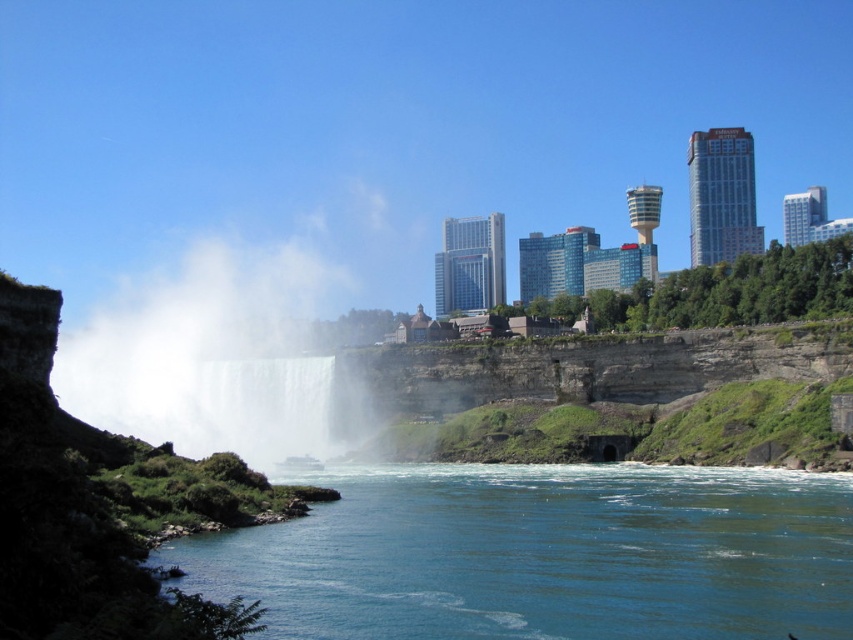
You are standing at the edge of the river and see the clear blue water at lower center and the white misty waterfall at center. Which object is closer to you?

The clear blue water at lower center is closer to you because it is in front of the white misty waterfall at center.

You are a photographer planning to capture the reflection of the white misty waterfall at center in the clear blue water at lower center. Based on the scene, can you determine if the reflection will be fully visible in the water?

The clear blue water at lower center might be wider than white misty waterfall at center, so the reflection of the white misty waterfall at center may not be fully visible in the clear blue water at lower center due to its width difference.